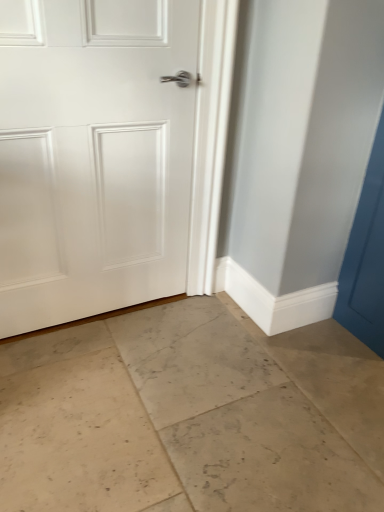
Question: Is beige marble floor at center at the left side of white matte door at center?

Choices:
 (A) yes
 (B) no

Answer: (B)

Question: Is beige marble floor at center outside white matte door at center?

Choices:
 (A) no
 (B) yes

Answer: (B)

Question: Considering the relative positions of beige marble floor at center and white matte door at center in the image provided, is beige marble floor at center to the right of white matte door at center from the viewer's perspective?

Choices:
 (A) no
 (B) yes

Answer: (B)

Question: Does beige marble floor at center have a lesser height compared to white matte door at center?

Choices:
 (A) yes
 (B) no

Answer: (A)

Question: Is beige marble floor at center further to the viewer compared to white matte door at center?

Choices:
 (A) yes
 (B) no

Answer: (B)

Question: From a real-world perspective, is beige marble floor at center positioned over white matte door at center based on gravity?

Choices:
 (A) yes
 (B) no

Answer: (B)

Question: Does white matte door at center have a greater width compared to beige marble floor at center?

Choices:
 (A) yes
 (B) no

Answer: (B)

Question: From the image's perspective, is white matte door at center over beige marble floor at center?

Choices:
 (A) no
 (B) yes

Answer: (B)

Question: Would you consider white matte door at center to be distant from beige marble floor at center?

Choices:
 (A) yes
 (B) no

Answer: (B)

Question: Is white matte door at center smaller than beige marble floor at center?

Choices:
 (A) no
 (B) yes

Answer: (B)

Question: Could you tell me if white matte door at center is facing beige marble floor at center?

Choices:
 (A) yes
 (B) no

Answer: (A)

Question: Is white matte door at center bigger than beige marble floor at center?

Choices:
 (A) no
 (B) yes

Answer: (A)

Question: Is beige marble floor at center inside the boundaries of white matte door at center, or outside?

Choices:
 (A) outside
 (B) inside

Answer: (A)